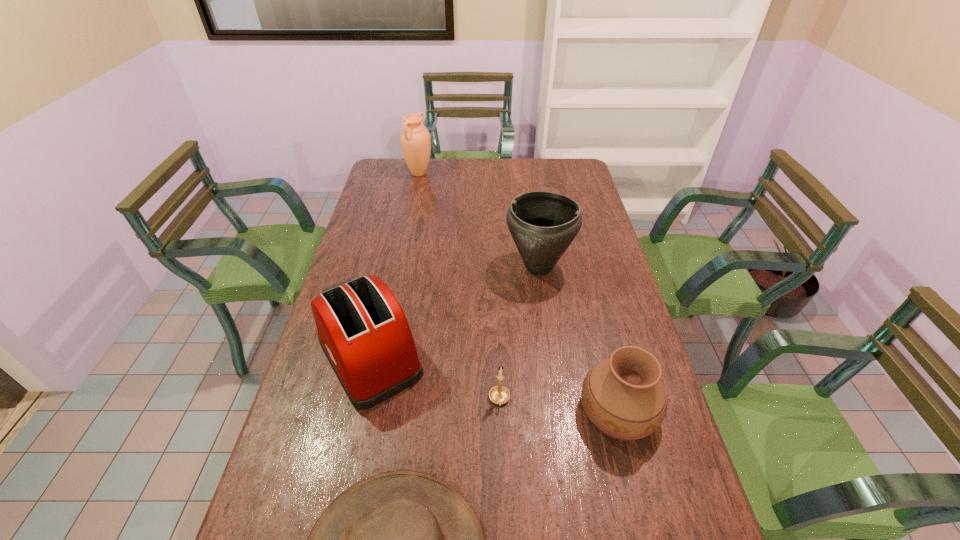
This screenshot has height=540, width=960. I want to click on vacant region located on the right of the toaster, so click(559, 358).

The width and height of the screenshot is (960, 540). What are the coordinates of `vacant space located 0.110m on the left of the nearest urn` in the screenshot? It's located at (536, 410).

This screenshot has height=540, width=960. Find the location of `vacant area situated 0.150m on the handle side of the fifth tallest object`. vacant area situated 0.150m on the handle side of the fifth tallest object is located at coordinates (502, 471).

You are a GUI agent. You are given a task and a screenshot of the screen. Output one action in this format:
    pyautogui.click(x=<x>, y=<y>)
    Task: Click on the object that is at the far edge
    Image resolution: width=960 pixels, height=540 pixels.
    Given the screenshot: What is the action you would take?
    pyautogui.click(x=415, y=140)

You are a GUI agent. You are given a task and a screenshot of the screen. Output one action in this format:
    pyautogui.click(x=<x>, y=<y>)
    Task: Click on the urn that is at the left edge
    This screenshot has height=540, width=960.
    Given the screenshot: What is the action you would take?
    click(x=415, y=140)

Identify the location of toaster positioned at the left edge. This screenshot has width=960, height=540. (362, 329).

This screenshot has width=960, height=540. Identify the location of object at the far left corner. (415, 140).

Where is `vacant space at the far edge of the desktop`? Image resolution: width=960 pixels, height=540 pixels. vacant space at the far edge of the desktop is located at coordinates (441, 173).

This screenshot has height=540, width=960. In order to click on free space at the left edge of the desktop in this screenshot , I will do `click(359, 257)`.

In the image, there is a desktop. Where is `vacant space at the right edge`? The width and height of the screenshot is (960, 540). vacant space at the right edge is located at coordinates [657, 438].